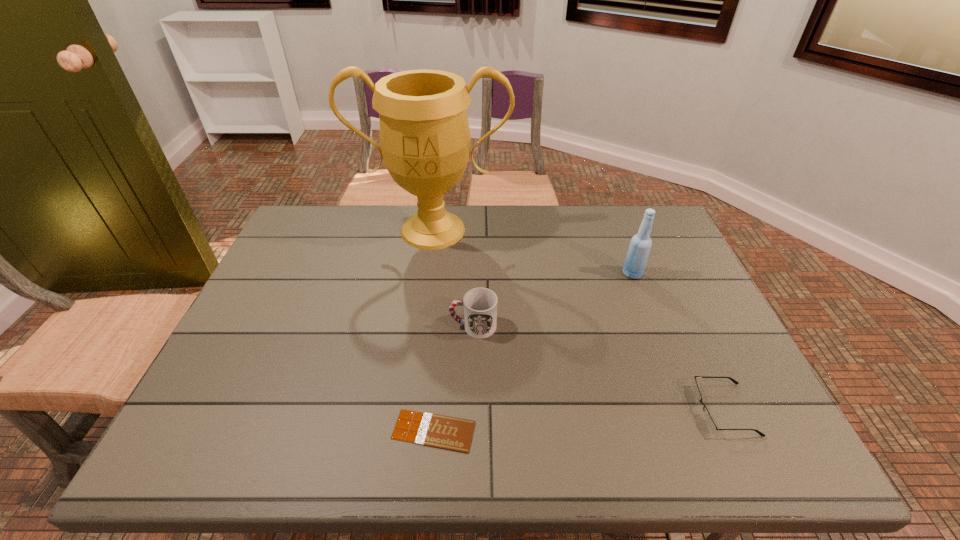
This screenshot has width=960, height=540. Identify the location of blank region between the second farthest object and the chocolate bar. (533, 352).

You are a GUI agent. You are given a task and a screenshot of the screen. Output one action in this format:
    pyautogui.click(x=<x>, y=<y>)
    Task: Click on the vacant region between the second shortest object and the third farthest object
    This screenshot has height=540, width=960.
    Given the screenshot: What is the action you would take?
    pyautogui.click(x=598, y=368)

Find the location of a particular element. The width and height of the screenshot is (960, 540). blank region between the cup and the second farthest object is located at coordinates (553, 300).

The width and height of the screenshot is (960, 540). I want to click on free space between the farthest object and the fourth tallest object, so click(578, 320).

You are a GUI agent. You are given a task and a screenshot of the screen. Output one action in this format:
    pyautogui.click(x=<x>, y=<y>)
    Task: Click on the vacant space in between the farthest object and the third tallest object
    The width and height of the screenshot is (960, 540).
    Given the screenshot: What is the action you would take?
    pyautogui.click(x=453, y=278)

Find the location of a particular element. Image resolution: width=960 pixels, height=540 pixels. empty space between the bottle and the chocolate bar is located at coordinates (533, 352).

Locate an element on the screen. The height and width of the screenshot is (540, 960). vacant space in between the chocolate bar and the tallest object is located at coordinates (433, 330).

Where is `empty location between the second tallest object and the trophy`? This screenshot has height=540, width=960. empty location between the second tallest object and the trophy is located at coordinates (533, 252).

Locate an element on the screen. object that is the second closest to the shortest object is located at coordinates (709, 422).

Identify the location of the third closest object to the chocolate bar. (425, 139).